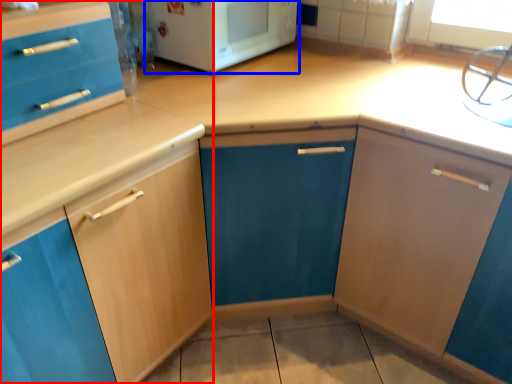
Question: Which object appears farthest to the camera in this image, cabinetry (highlighted by a red box) or home appliance (highlighted by a blue box)?

Choices:
 (A) cabinetry
 (B) home appliance

Answer: (B)